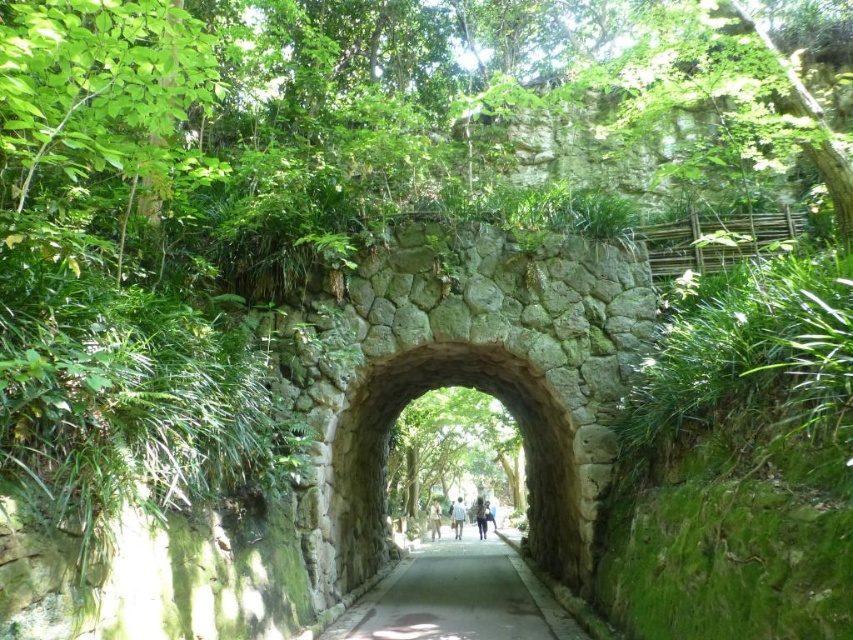
Question: In this image, where is natural stone archway at center located relative to dark blue fabric at center?

Choices:
 (A) right
 (B) left

Answer: (B)

Question: Among these points, which one is nearest to the camera?

Choices:
 (A) (430, 506)
 (B) (364, 508)
 (C) (461, 500)
 (D) (527, 628)

Answer: (D)

Question: Can you confirm if natural stone archway at center is positioned to the left of dark blue fabric at center?

Choices:
 (A) no
 (B) yes

Answer: (B)

Question: Does blue fabric bag at center have a lesser width compared to light brown textured shirt at center?

Choices:
 (A) no
 (B) yes

Answer: (A)

Question: Among these objects, which one is farthest from the camera?

Choices:
 (A) gray concrete path at center
 (B) blue fabric bag at center

Answer: (B)

Question: Among these points, which one is nearest to the camera?

Choices:
 (A) (473, 508)
 (B) (451, 525)

Answer: (A)